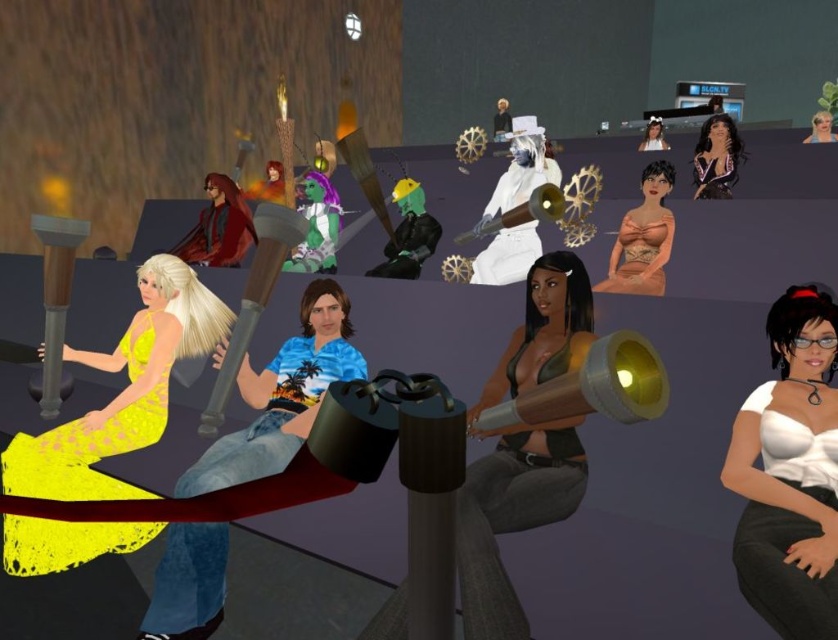
Question: Which point is closer to the camera?

Choices:
 (A) (707, 192)
 (B) (821, 548)

Answer: (B)

Question: Does matte peach dress at center come in front of shiny black dress at upper right?

Choices:
 (A) no
 (B) yes

Answer: (B)

Question: Which point is farther to the camera?

Choices:
 (A) shiny black dress at upper right
 (B) yellow lace dress at lower left
 (C) white matte blouse at center

Answer: (A)

Question: Does shiny purple dress at upper right have a larger size compared to smooth white hair at upper right?

Choices:
 (A) no
 (B) yes

Answer: (A)

Question: Which point is farther to the camera?

Choices:
 (A) smooth blonde hair at upper right
 (B) smooth white hair at upper right
 (C) yellow lace dress at lower left
 (D) yellow satin dress at center

Answer: (B)

Question: Is white matte blouse at center positioned behind smooth white hair at upper right?

Choices:
 (A) yes
 (B) no

Answer: (B)